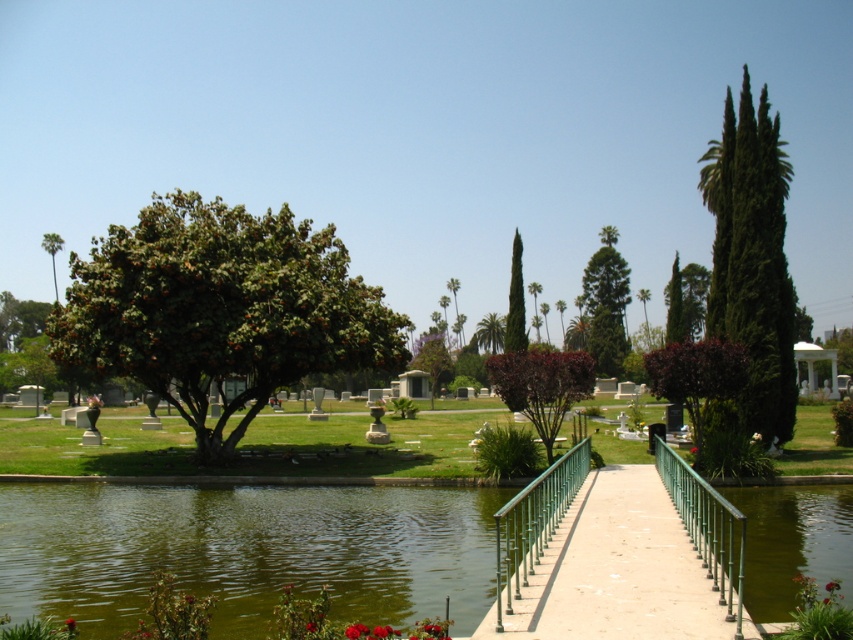
Consider the image. Is green coniferous tree at right wider than green metal/rail at center?

Yes, green coniferous tree at right is wider than green metal/rail at center.

Does point (773, 428) come in front of point (538, 524)?

No.

The height and width of the screenshot is (640, 853). In order to click on green coniferous tree at right in this screenshot , I will do pyautogui.click(x=750, y=284).

Measure the distance between green metal railing at center and green leafy palm tree at upper left.

The distance of green metal railing at center from green leafy palm tree at upper left is 93.17 meters.

Who is more forward, (706,497) or (47,243)?

Point (706,497)

The height and width of the screenshot is (640, 853). Describe the element at coordinates (706, 525) in the screenshot. I see `green metal railing at center` at that location.

This screenshot has height=640, width=853. What are the coordinates of `green metal railing at center` in the screenshot? It's located at (706, 525).

Who is positioned more to the right, green textured tree at center or green leafy palm tree at upper left?

From the viewer's perspective, green textured tree at center appears more on the right side.

Is green textured tree at center below green leafy palm tree at upper left?

Yes.

Between point (590, 269) and point (50, 237), which one is positioned behind?

The point (590, 269) is behind.

Find the location of `green textured tree at center`. green textured tree at center is located at coordinates (606, 305).